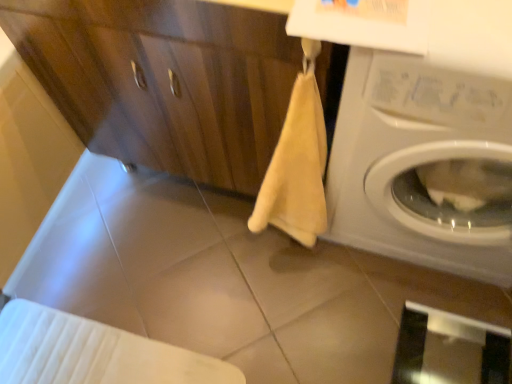
This screenshot has width=512, height=384. I want to click on vacant space situated above transparent glass screen door at lower right (from a real-world perspective), so click(x=451, y=354).